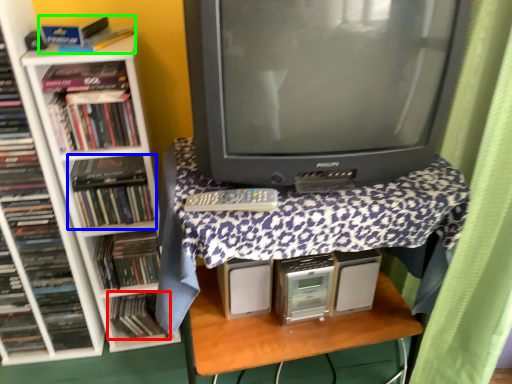
Question: Based on their relative distances, which object is farther from book (highlighted by a red box)? Choose from book (highlighted by a blue box) and book (highlighted by a green box).

Choices:
 (A) book
 (B) book

Answer: (B)